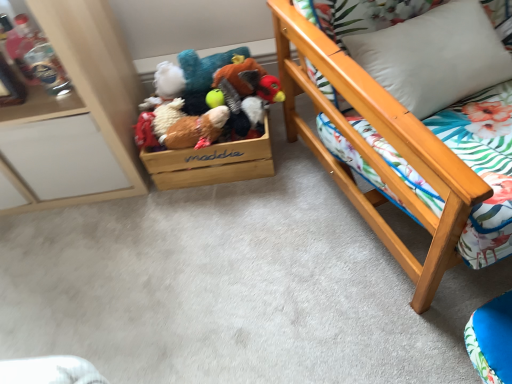
Identify the location of vacant area that lies in front of wooden plush toys at center, which is counted as the 2th toy, starting from the front. The image size is (512, 384). (232, 228).